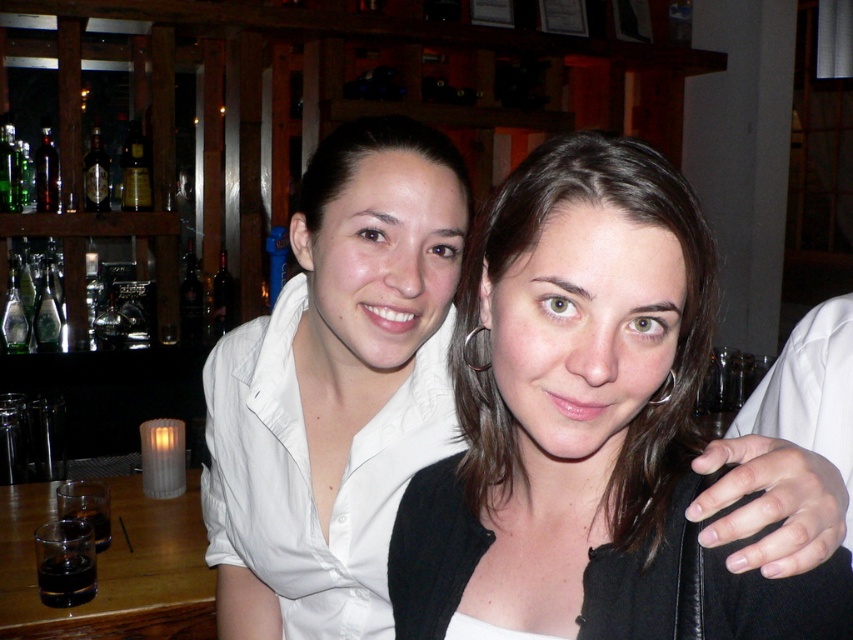
You are a photographer trying to capture a clear shot of both the matte black jacket at center and the white matte shirt at center. Since you want to ensure both are fully visible, which object should you adjust your camera angle to focus on first, considering their size?

The matte black jacket at center has a lesser height compared to the white matte shirt at center, so you should focus on the white matte shirt at center first to ensure it is fully in frame before adjusting for the smaller matte black jacket at center.

You are a bartender preparing drinks and need to choose a bottle for a cocktail. You have the shiny gold bottle at upper left and the dark amber glass bottle at upper left. Which one is smaller in size?

The shiny gold bottle at upper left is smaller in size compared to the dark amber glass bottle at upper left according to the description.

You are a bartender preparing a drink and need to reach the shiny gold bottle at upper left. From your current position at the center of the bar, which direction should you move to get it?

The shiny gold bottle at upper left is located at point (135, 170), which is to the upper left direction from the center of the bar. Move towards the upper left to reach it.